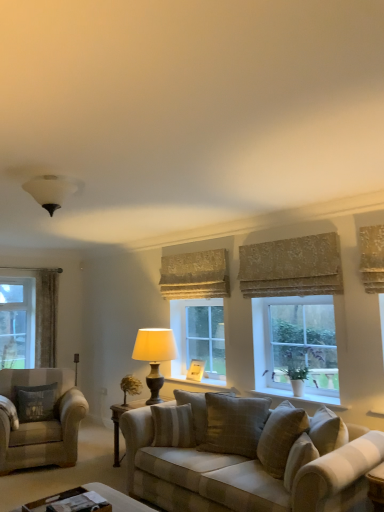
Question: Is matte beige lamp at window, which appears as the first lamp when viewed from the right, looking in the opposite direction of wooden at center?

Choices:
 (A) yes
 (B) no

Answer: (A)

Question: Is matte beige lamp at window, the 1th lamp from the back, aimed at wooden at center?

Choices:
 (A) no
 (B) yes

Answer: (A)

Question: Considering the relative positions of matte beige lamp at window, positioned as the 2th lamp in top-to-bottom order, and wooden at center in the image provided, is matte beige lamp at window, positioned as the 2th lamp in top-to-bottom order, to the left of wooden at center from the viewer's perspective?

Choices:
 (A) yes
 (B) no

Answer: (A)

Question: Does matte beige lamp at window, the 1th lamp in the bottom-to-top sequence, touch wooden at center?

Choices:
 (A) no
 (B) yes

Answer: (A)

Question: Is matte beige lamp at window, the 1th lamp in the bottom-to-top sequence, positioned in front of wooden at center?

Choices:
 (A) no
 (B) yes

Answer: (B)

Question: Looking at their shapes, would you say wooden picture frame at center is wider or thinner than wooden at center?

Choices:
 (A) wide
 (B) thin

Answer: (B)

Question: Is wooden picture frame at center situated inside wooden at center or outside?

Choices:
 (A) inside
 (B) outside

Answer: (B)

Question: Would you say wooden picture frame at center is to the left or to the right of wooden at center in the picture?

Choices:
 (A) left
 (B) right

Answer: (A)

Question: Considering the positions of wooden picture frame at center and wooden at center in the image, is wooden picture frame at center taller or shorter than wooden at center?

Choices:
 (A) tall
 (B) short

Answer: (A)

Question: In the image, is textured gray pillow at center, arranged as the 1th pillow when viewed from the front, positioned in front of or behind white matte lampshade at upper center, which ranks as the second lamp in bottom-to-top order?

Choices:
 (A) behind
 (B) front

Answer: (A)

Question: From the image's perspective, relative to white matte lampshade at upper center, which is the 1th lamp from top to bottom, is textured gray pillow at center, the 3th pillow viewed from the back, above or below?

Choices:
 (A) above
 (B) below

Answer: (B)

Question: Looking at the image, does textured gray pillow at center, acting as the 1th pillow starting from the right, seem bigger or smaller compared to white matte lampshade at upper center, which ranks as the second lamp in bottom-to-top order?

Choices:
 (A) small
 (B) big

Answer: (B)

Question: Considering the positions of textured gray pillow at center, the 3th pillow viewed from the back, and white matte lampshade at upper center, arranged as the second lamp when viewed from the back, in the image, is textured gray pillow at center, the 3th pillow viewed from the back, wider or thinner than white matte lampshade at upper center, arranged as the second lamp when viewed from the back,?

Choices:
 (A) thin
 (B) wide

Answer: (B)

Question: Would you say white matte lampshade at upper center, the first lamp from the front, is to the left or to the right of velvet curtain at left, which is counted as the first curtain, starting from the back, in the picture?

Choices:
 (A) right
 (B) left

Answer: (A)

Question: Considering the positions of point tap(61, 198) and point tap(48, 287), is point tap(61, 198) closer or farther from the camera than point tap(48, 287)?

Choices:
 (A) farther
 (B) closer

Answer: (B)